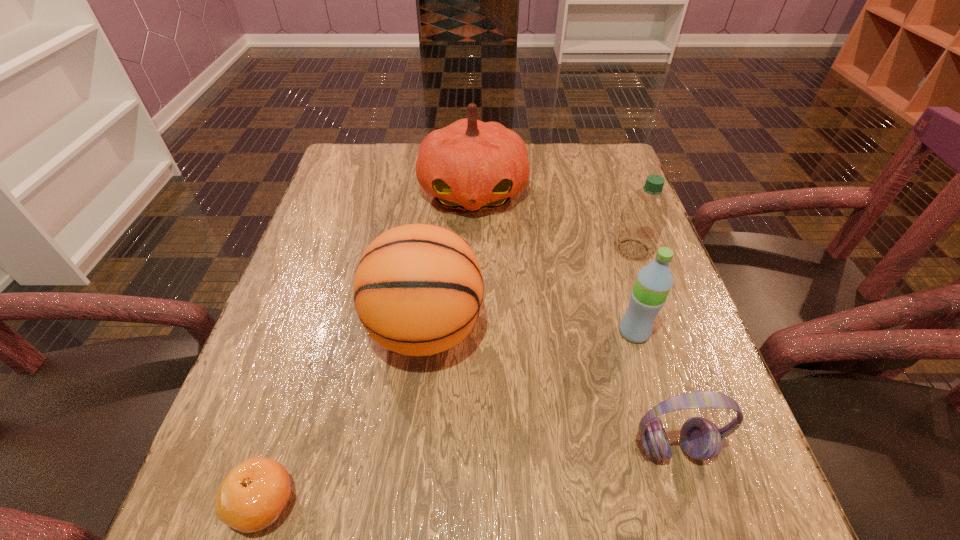
Find the location of `free space between the basketball and the nearer water bottle`. free space between the basketball and the nearer water bottle is located at coordinates (530, 331).

Where is `free spot between the fifth nearest object and the second shortest object`? The image size is (960, 540). free spot between the fifth nearest object and the second shortest object is located at coordinates (653, 348).

Identify the location of free spot between the second farthest object and the clementine. (448, 376).

This screenshot has height=540, width=960. Identify the location of free space between the basketball and the clementine. (345, 416).

Locate an element on the screen. Image resolution: width=960 pixels, height=540 pixels. blank region between the fifth nearest object and the leftmost object is located at coordinates (448, 376).

At what (x,y) coordinates should I click in order to perform the action: click on object that is the second nearest to the pumpkin. Please return your answer as a coordinate pair (x, y). The height and width of the screenshot is (540, 960). Looking at the image, I should click on (418, 290).

Select which object is the fourth closest to the shortest object. Please provide its 2D coordinates. Your answer should be formatted as a tuple, i.e. [(x, y)], where the tuple contains the x and y coordinates of a point satisfying the conditions above.

[(471, 165)]

Find the location of a particular element. The height and width of the screenshot is (540, 960). free point that satisfies the following two spatial constraints: 1. on the front-facing side of the pumpkin; 2. on the left side of the nearer water bottle is located at coordinates (470, 332).

Locate an element on the screen. This screenshot has width=960, height=540. vacant space that satisfies the following two spatial constraints: 1. on the back side of the farther water bottle; 2. on the left side of the basketball is located at coordinates (434, 249).

The height and width of the screenshot is (540, 960). What are the coordinates of `free point that satisfies the following two spatial constraints: 1. on the front-facing side of the nearer water bottle; 2. on the left side of the farthest object` in the screenshot? It's located at (470, 332).